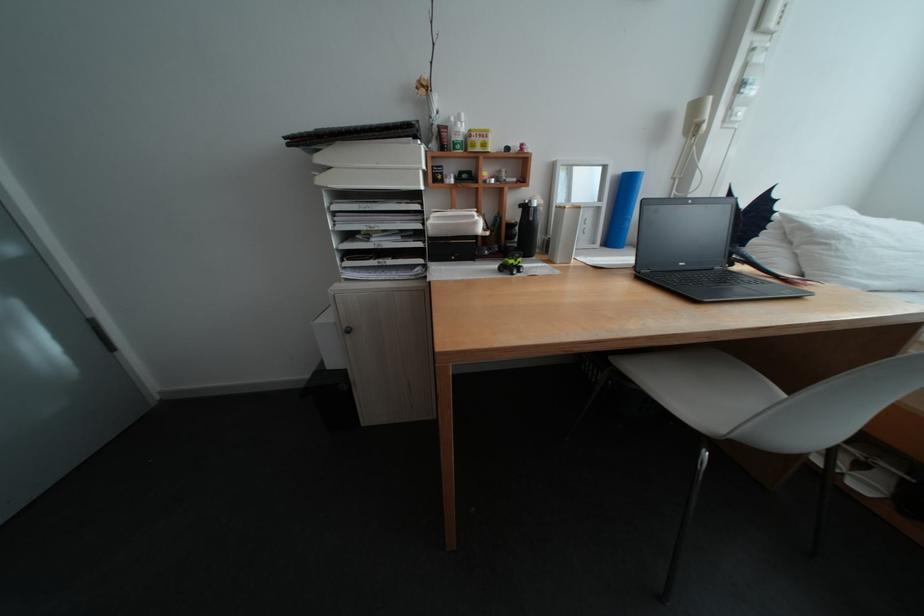
Where is `white chair sitting surface`? This screenshot has width=924, height=616. white chair sitting surface is located at coordinates (700, 386).